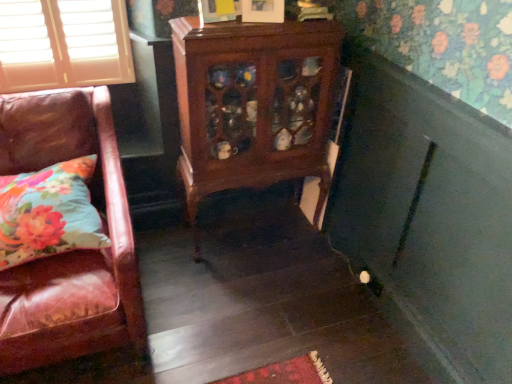
Question: Does mahogany cabinet at center have a greater height compared to floral fabric pillow at lower left?

Choices:
 (A) yes
 (B) no

Answer: (A)

Question: Is mahogany cabinet at center turned away from floral fabric pillow at lower left?

Choices:
 (A) no
 (B) yes

Answer: (A)

Question: Considering the relative sizes of mahogany cabinet at center and floral fabric pillow at lower left in the image provided, is mahogany cabinet at center wider than floral fabric pillow at lower left?

Choices:
 (A) yes
 (B) no

Answer: (B)

Question: Does mahogany cabinet at center come behind floral fabric pillow at lower left?

Choices:
 (A) no
 (B) yes

Answer: (B)

Question: Is mahogany cabinet at center not close to floral fabric pillow at lower left?

Choices:
 (A) no
 (B) yes

Answer: (A)

Question: Can you confirm if mahogany cabinet at center is bigger than floral fabric pillow at lower left?

Choices:
 (A) no
 (B) yes

Answer: (B)

Question: From a real-world perspective, is floral fabric pillow at lower left under mahogany cabinet at center?

Choices:
 (A) yes
 (B) no

Answer: (B)

Question: Does floral fabric pillow at lower left have a lesser width compared to mahogany cabinet at center?

Choices:
 (A) yes
 (B) no

Answer: (B)

Question: Considering the relative positions of floral fabric pillow at lower left and mahogany cabinet at center in the image provided, is floral fabric pillow at lower left in front of mahogany cabinet at center?

Choices:
 (A) no
 (B) yes

Answer: (B)

Question: Is floral fabric pillow at lower left positioned behind mahogany cabinet at center?

Choices:
 (A) no
 (B) yes

Answer: (A)

Question: From the image's perspective, is floral fabric pillow at lower left located above mahogany cabinet at center?

Choices:
 (A) yes
 (B) no

Answer: (B)

Question: Can you confirm if floral fabric pillow at lower left is shorter than mahogany cabinet at center?

Choices:
 (A) yes
 (B) no

Answer: (A)

Question: From the image's perspective, is floral fabric pillow at lower left positioned above or below mahogany cabinet at center?

Choices:
 (A) below
 (B) above

Answer: (A)